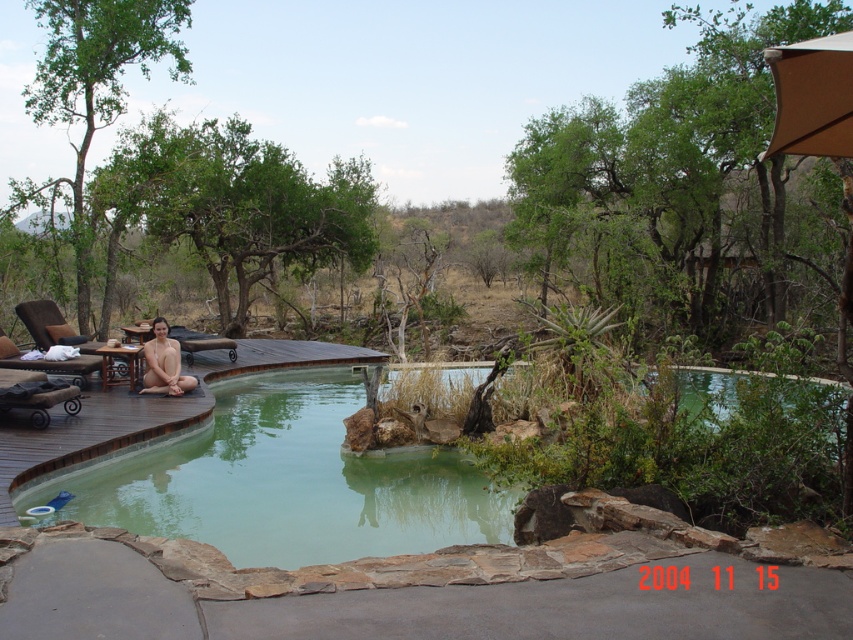
Question: Does brown wooden deck at lower left have a larger size compared to nude skin at lower left?

Choices:
 (A) yes
 (B) no

Answer: (A)

Question: Does green stone pool at center lie in front of nude skin at lower left?

Choices:
 (A) yes
 (B) no

Answer: (A)

Question: Which point is farther to the camera?

Choices:
 (A) (715, 372)
 (B) (6, 465)

Answer: (A)

Question: Which of the following is the closest to the observer?

Choices:
 (A) (33, 449)
 (B) (328, 476)
 (C) (782, 102)
 (D) (146, 385)

Answer: (C)

Question: Does brown wooden deck at lower left appear on the right side of tan fabric umbrella at upper right?

Choices:
 (A) yes
 (B) no

Answer: (B)

Question: Which point is closer to the camera?

Choices:
 (A) tan fabric umbrella at upper right
 (B) green stone pool at center
 (C) brown wooden deck at lower left

Answer: (A)